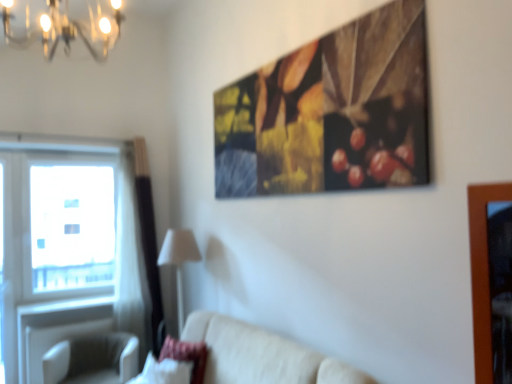
Question: From the image's perspective, is beige fabric couch at lower center on transparent glass window at left?

Choices:
 (A) no
 (B) yes

Answer: (A)

Question: Is beige fabric couch at lower center shorter than transparent glass window at left?

Choices:
 (A) yes
 (B) no

Answer: (A)

Question: Is beige fabric couch at lower center bigger than transparent glass window at left?

Choices:
 (A) no
 (B) yes

Answer: (B)

Question: From the image's perspective, would you say beige fabric couch at lower center is shown under transparent glass window at left?

Choices:
 (A) yes
 (B) no

Answer: (A)

Question: Is beige fabric couch at lower center thinner than transparent glass window at left?

Choices:
 (A) yes
 (B) no

Answer: (B)

Question: Would you say velvet pink pillow at lower left is to the left or to the right of beige fabric couch at lower center in the picture?

Choices:
 (A) left
 (B) right

Answer: (A)

Question: Is velvet pink pillow at lower left spatially inside beige fabric couch at lower center, or outside of it?

Choices:
 (A) outside
 (B) inside

Answer: (B)

Question: From the image's perspective, is velvet pink pillow at lower left above or below beige fabric couch at lower center?

Choices:
 (A) above
 (B) below

Answer: (B)

Question: From a real-world perspective, is velvet pink pillow at lower left physically located above or below beige fabric couch at lower center?

Choices:
 (A) below
 (B) above

Answer: (B)

Question: Looking at the image, does transparent glass window at left seem bigger or smaller compared to white fabric lampshade at lower center?

Choices:
 (A) big
 (B) small

Answer: (A)

Question: Based on their positions, is transparent glass window at left located to the left or right of white fabric lampshade at lower center?

Choices:
 (A) right
 (B) left

Answer: (B)

Question: Is transparent glass window at left situated inside white fabric lampshade at lower center or outside?

Choices:
 (A) outside
 (B) inside

Answer: (A)

Question: Considering the positions of point (77, 283) and point (181, 243), is point (77, 283) closer or farther from the camera than point (181, 243)?

Choices:
 (A) farther
 (B) closer

Answer: (A)

Question: Looking at their shapes, would you say beige fabric couch at lower center is wider or thinner than metallic chandelier at upper left?

Choices:
 (A) thin
 (B) wide

Answer: (B)

Question: Is point (301, 360) positioned closer to the camera than point (69, 24)?

Choices:
 (A) closer
 (B) farther

Answer: (B)